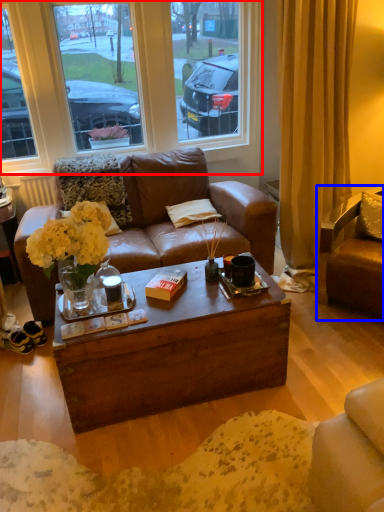
Question: Which of the following is the farthest to the observer, window (highlighted by a red box) or chair (highlighted by a blue box)?

Choices:
 (A) window
 (B) chair

Answer: (A)